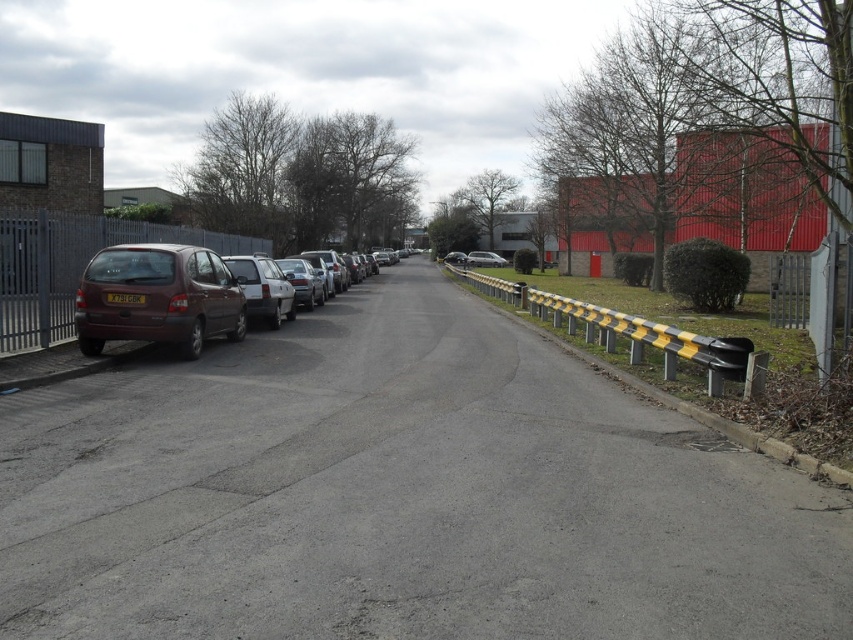
Question: Does matte brown minivan at left appear on the left side of metallic gray fence at left?

Choices:
 (A) yes
 (B) no

Answer: (B)

Question: Considering the relative positions of matte brown minivan at left and yellow/black striped barrier at center-right in the image provided, where is matte brown minivan at left located with respect to yellow/black striped barrier at center-right?

Choices:
 (A) right
 (B) left

Answer: (B)

Question: Can you confirm if matte dark brown hatchback at left is positioned to the right of metallic gray fence at left?

Choices:
 (A) yes
 (B) no

Answer: (A)

Question: Which point appears farthest from the camera in this image?

Choices:
 (A) (518, 296)
 (B) (277, 266)

Answer: (A)

Question: Estimate the real-world distances between objects in this image. Which object is farther from the matte dark brown hatchback at left?

Choices:
 (A) silver metallic sedan at center
 (B) metallic gray fence at left
 (C) matte brown minivan at left
 (D) yellow/black striped barrier at center-right

Answer: (A)

Question: Considering the real-world distances, which object is closest to the matte brown minivan at left?

Choices:
 (A) matte dark brown hatchback at left
 (B) metallic gray fence at left
 (C) yellow/black striped barrier at center-right

Answer: (A)